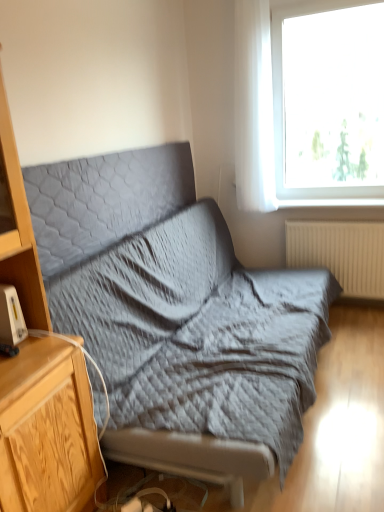
Find the location of a particular element. textured gray fabric studio couch at center is located at coordinates (173, 311).

Measure the distance between point (250, 57) and camera.

The depth of point (250, 57) is 3.05 meters.

Measure the distance between transparent glass window at upper right and camera.

transparent glass window at upper right and camera are 9.29 feet apart from each other.

What do you see at coordinates (104, 200) in the screenshot?
I see `gray quilted pillow at upper center` at bounding box center [104, 200].

I want to click on wooden cabinet at left, so click(47, 430).

Locate an element on the screen. This screenshot has width=384, height=512. textured gray fabric studio couch at center is located at coordinates (173, 311).

Considering the positions of objects beige ribbed radiator at lower right and wooden cabinet at left in the image provided, who is more to the left, beige ribbed radiator at lower right or wooden cabinet at left?

From the viewer's perspective, wooden cabinet at left appears more on the left side.

How different are the orientations of beige ribbed radiator at lower right and wooden cabinet at left in degrees?

90.6 degrees.

Looking at this image, from the image's perspective, is beige ribbed radiator at lower right beneath wooden cabinet at left?

No, from the image's perspective, beige ribbed radiator at lower right is not below wooden cabinet at left.

Consider the image. Can you confirm if beige ribbed radiator at lower right is smaller than wooden cabinet at left?

Correct, beige ribbed radiator at lower right occupies less space than wooden cabinet at left.

From the image's perspective, is gray quilted pillow at upper center positioned above or below beige ribbed radiator at lower right?

From the image's perspective, gray quilted pillow at upper center appears above beige ribbed radiator at lower right.

Is gray quilted pillow at upper center in front of or behind beige ribbed radiator at lower right in the image?

gray quilted pillow at upper center is in front of beige ribbed radiator at lower right.

Is gray quilted pillow at upper center to the left or to the right of beige ribbed radiator at lower right in the image?

Clearly, gray quilted pillow at upper center is on the left of beige ribbed radiator at lower right in the image.

Can we say gray quilted pillow at upper center lies outside beige ribbed radiator at lower right?

Yes, gray quilted pillow at upper center is located beyond the bounds of beige ribbed radiator at lower right.

From a real-world perspective, which is physically below, transparent glass window at upper right or beige ribbed radiator at lower right?

beige ribbed radiator at lower right.

Does transparent glass window at upper right appear on the right side of beige ribbed radiator at lower right?

No.

Is beige ribbed radiator at lower right completely or partially inside transparent glass window at upper right?

Actually, beige ribbed radiator at lower right is outside transparent glass window at upper right.

From the image's perspective, between transparent glass window at upper right and beige ribbed radiator at lower right, who is located below?

beige ribbed radiator at lower right is shown below in the image.

Is point (35, 283) more distant than point (8, 323)?

That is True.

From the image's perspective, between wooden cabinet at left and white plastic gadget at left, who is located below?

wooden cabinet at left, from the image's perspective.

Which is in front, wooden cabinet at left or white plastic gadget at left?

wooden cabinet at left is closer to the camera.

Is gray quilted pillow at upper center inside wooden cabinet at left?

No, gray quilted pillow at upper center is not a part of wooden cabinet at left.

Is wooden cabinet at left not close to gray quilted pillow at upper center?

wooden cabinet at left is actually quite close to gray quilted pillow at upper center.

Locate an element on the screen. This screenshot has height=512, width=384. cabinetry directly beneath the gray quilted pillow at upper center (from a real-world perspective) is located at coordinates (47, 430).

From a real-world perspective, who is located lower, wooden cabinet at left or gray quilted pillow at upper center?

From a 3D spatial view, wooden cabinet at left is below.

Locate an element on the screen. Image resolution: width=384 pixels, height=512 pixels. gadget located in front of the beige ribbed radiator at lower right is located at coordinates (11, 317).

Is beige ribbed radiator at lower right oriented away from white plastic gadget at left?

beige ribbed radiator at lower right does not have its back to white plastic gadget at left.

From the image's perspective, is beige ribbed radiator at lower right positioned above or below white plastic gadget at left?

From the image's perspective, beige ribbed radiator at lower right appears above white plastic gadget at left.

Is point (59, 167) closer or farther from the camera than point (120, 197)?

Point (59, 167) is closer to the camera than point (120, 197).

Which of these two, textured gray fabric studio couch at center or gray quilted pillow at upper center, stands shorter?

gray quilted pillow at upper center is shorter.

From a real-world perspective, which is physically below, textured gray fabric studio couch at center or gray quilted pillow at upper center?

textured gray fabric studio couch at center is physically lower.

You are a GUI agent. You are given a task and a screenshot of the screen. Output one action in this format:
    pyautogui.click(x=<x>, y=<y>)
    Task: Click on the radiator located above the wooden cabinet at left (from the image's perspective)
    The height and width of the screenshot is (512, 384).
    Given the screenshot: What is the action you would take?
    pyautogui.click(x=341, y=253)

Find the location of a particular element. This screenshot has width=384, height=512. pillow in front of the beige ribbed radiator at lower right is located at coordinates (104, 200).

Estimate the real-world distances between objects in this image. Which object is closer to gray quilted pillow at upper center, beige ribbed radiator at lower right or transparent glass window at upper right?

transparent glass window at upper right.

Consider the image. When comparing their distances from textured gray fabric studio couch at center, does transparent glass window at upper right or gray quilted pillow at upper center seem further?

The object further to textured gray fabric studio couch at center is transparent glass window at upper right.

When comparing their distances from gray quilted pillow at upper center, does textured gray fabric studio couch at center or white plastic gadget at left seem further?

The object further to gray quilted pillow at upper center is white plastic gadget at left.

Considering their positions, is white plastic gadget at left positioned further to wooden cabinet at left than textured gray fabric studio couch at center?

Among the two, textured gray fabric studio couch at center is located further to wooden cabinet at left.

Estimate the real-world distances between objects in this image. Which object is closer to beige ribbed radiator at lower right, textured gray fabric studio couch at center or transparent glass window at upper right?

transparent glass window at upper right is closer to beige ribbed radiator at lower right.

Consider the image. Considering their positions, is transparent glass window at upper right positioned closer to textured gray fabric studio couch at center than white plastic gadget at left?

white plastic gadget at left lies closer to textured gray fabric studio couch at center than the other object.

Considering their positions, is beige ribbed radiator at lower right positioned closer to white plastic gadget at left than wooden cabinet at left?

Based on the image, wooden cabinet at left appears to be nearer to white plastic gadget at left.

Looking at the image, which one is located further to wooden cabinet at left, beige ribbed radiator at lower right or transparent glass window at upper right?

The object further to wooden cabinet at left is beige ribbed radiator at lower right.

The width and height of the screenshot is (384, 512). What are the coordinates of `gadget positioned between wooden cabinet at left and beige ribbed radiator at lower right from near to far` in the screenshot? It's located at (11, 317).

Find the location of a particular element. This screenshot has height=512, width=384. pillow between wooden cabinet at left and transparent glass window at upper right in the front-back direction is located at coordinates (104, 200).

In order to click on window between white plastic gadget at left and beige ribbed radiator at lower right in this screenshot , I will do `click(274, 113)`.

Find the location of a particular element. Image resolution: width=384 pixels, height=512 pixels. studio couch between wooden cabinet at left and beige ribbed radiator at lower right in the front-back direction is located at coordinates (173, 311).